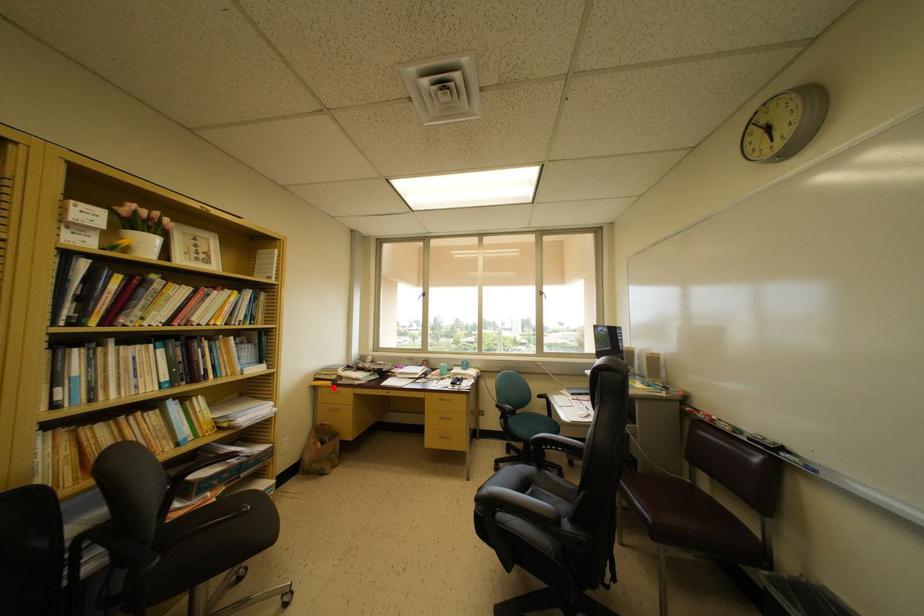
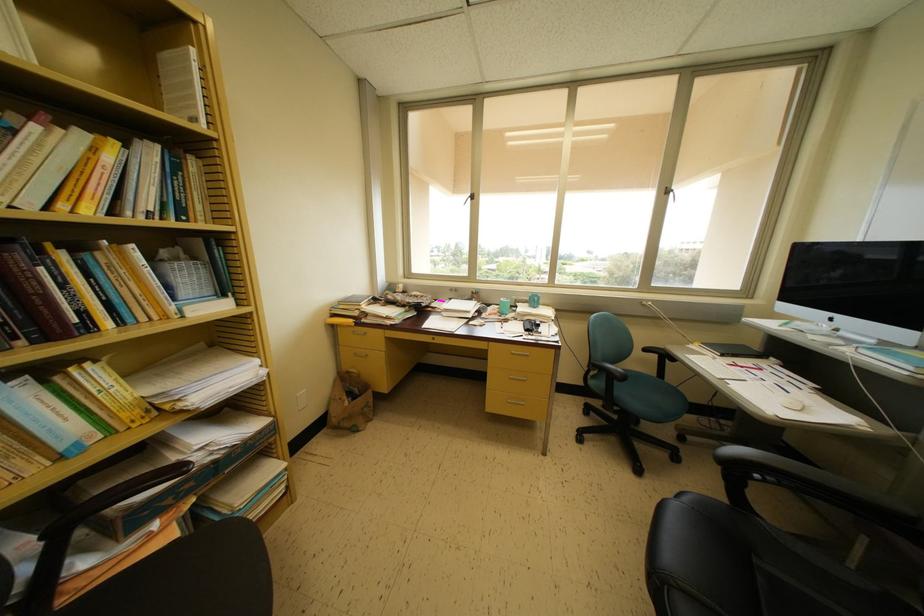
Find the pixel in the second image that matches the highlighted location in the first image.

(355, 326)